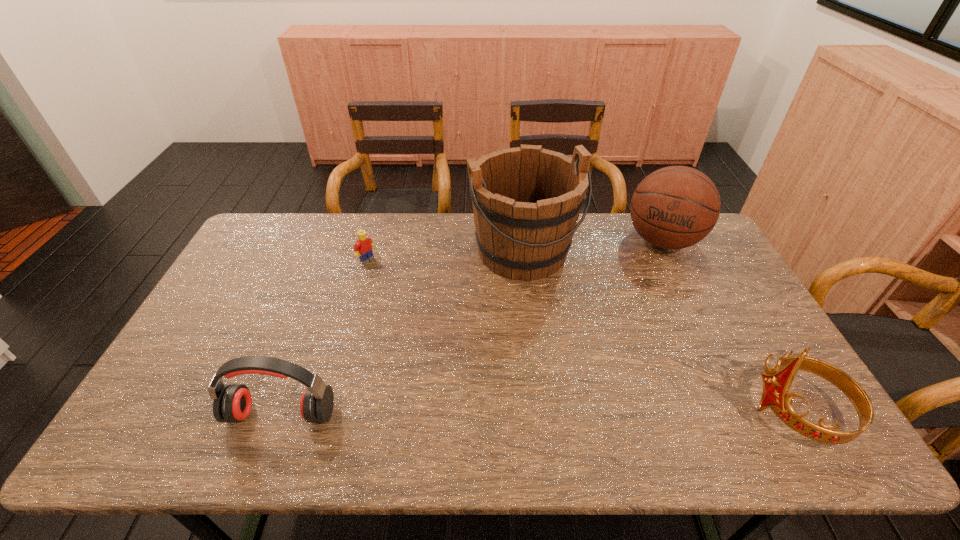
This screenshot has height=540, width=960. Identify the location of free space on the desktop that is between the fourth tallest object and the tiara and is positioned on the front-facing side of the shortest object. (579, 413).

This screenshot has height=540, width=960. Identify the location of vacant space on the desktop that is between the second shortest object and the tiara and is positioned on the side of the wine bucket with the handle for carrying. (610, 413).

I want to click on free space on the desktop that is between the earphone and the tiara and is positioned on the side with brand label of the basketball, so click(606, 413).